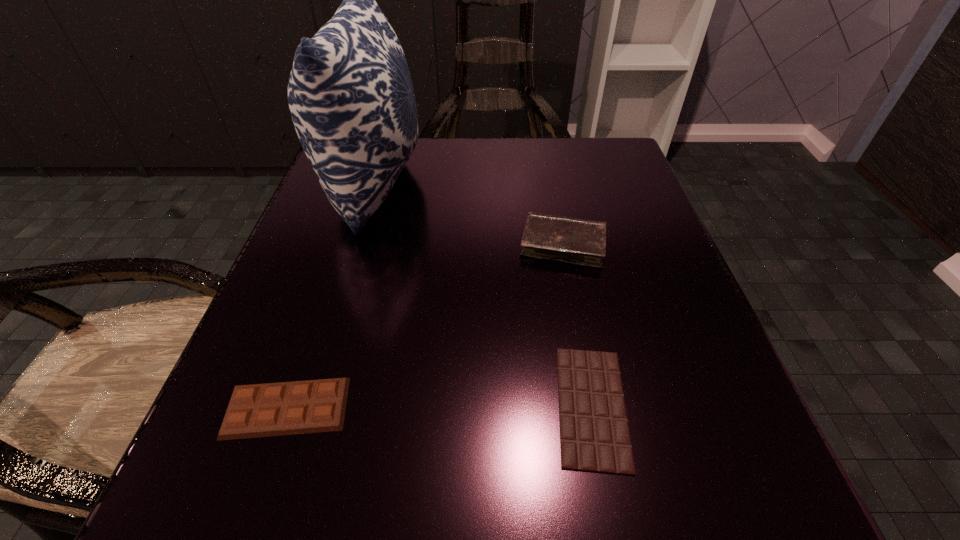
Locate an element on the screen. free space in the image that satisfies the following two spatial constraints: 1. on the front surface of the tallest object; 2. on the left side of the right chocolate bar is located at coordinates (307, 406).

Where is `free space that satisfies the following two spatial constraints: 1. on the front surface of the diary; 2. on the right side of the cushion`? The height and width of the screenshot is (540, 960). free space that satisfies the following two spatial constraints: 1. on the front surface of the diary; 2. on the right side of the cushion is located at coordinates (356, 244).

I want to click on vacant region that satisfies the following two spatial constraints: 1. on the front surface of the cushion; 2. on the front side of the taller chocolate bar, so click(306, 408).